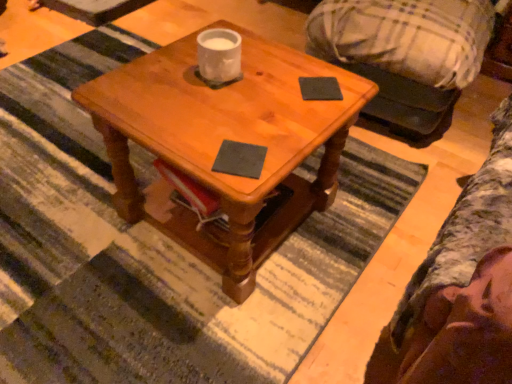
Identify the location of vacant point to the right of black matte notepad at upper right, placed as the second notepad when sorted from bottom to top. This screenshot has width=512, height=384. (356, 89).